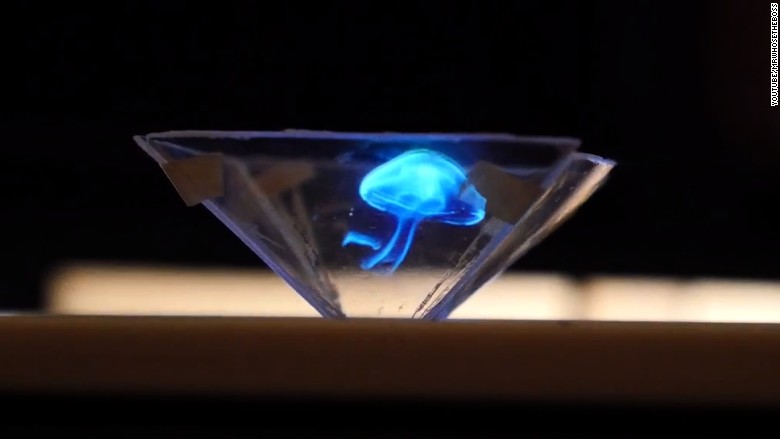
The width and height of the screenshot is (780, 439). Identify the location of cardboard holder. (523, 187), (277, 179), (207, 176).